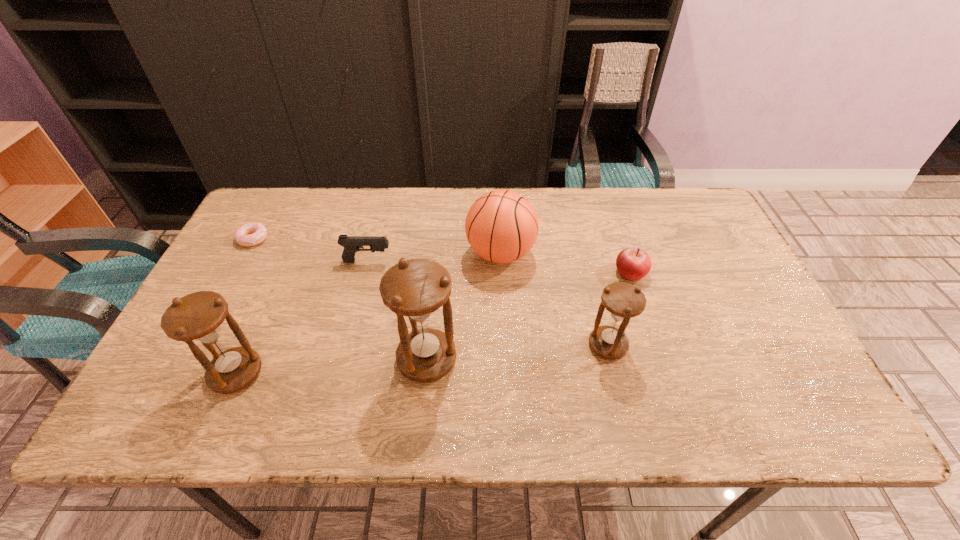
Identify which hourglass is the nearest to the second object from right to left. Please provide its 2D coordinates. Your answer should be formatted as a tuple, i.e. [(x, y)], where the tuple contains the x and y coordinates of a point satisfying the conditions above.

[(415, 288)]

Locate which hourglass ranks in proximity to the third object from right to left. Please provide its 2D coordinates. Your answer should be formatted as a tuple, i.e. [(x, y)], where the tuple contains the x and y coordinates of a point satisfying the conditions above.

[(415, 288)]

You are a GUI agent. You are given a task and a screenshot of the screen. Output one action in this format:
    pyautogui.click(x=<x>, y=<y>)
    Task: Click on the free point that satisfies the following two spatial constraints: 1. on the back side of the second shortest hourglass; 2. on the left side of the rightmost object
    The height and width of the screenshot is (540, 960).
    Given the screenshot: What is the action you would take?
    pyautogui.click(x=280, y=273)

You are a GUI agent. You are given a task and a screenshot of the screen. Output one action in this format:
    pyautogui.click(x=<x>, y=<y>)
    Task: Click on the free space that satisfies the following two spatial constraints: 1. at the barrel of the third object from left to right; 2. on the left side of the rightmost hourglass
    
    Given the screenshot: What is the action you would take?
    pyautogui.click(x=346, y=346)

Identify the location of vacant space that satisfies the following two spatial constraints: 1. at the barrel of the fifth object from right to left; 2. on the front side of the leftmost hourglass. The width and height of the screenshot is (960, 540). (339, 373).

Locate an element on the screen. vacant area in the image that satisfies the following two spatial constraints: 1. at the barrel of the pistol; 2. on the right side of the tallest object is located at coordinates (343, 359).